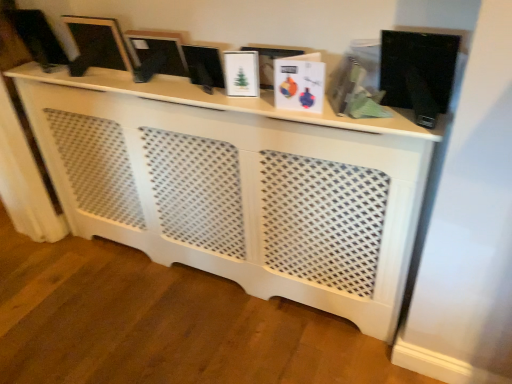
The height and width of the screenshot is (384, 512). I want to click on vacant area that is in front of matte black frame at upper left, the second computer monitor viewed from the right, so click(115, 81).